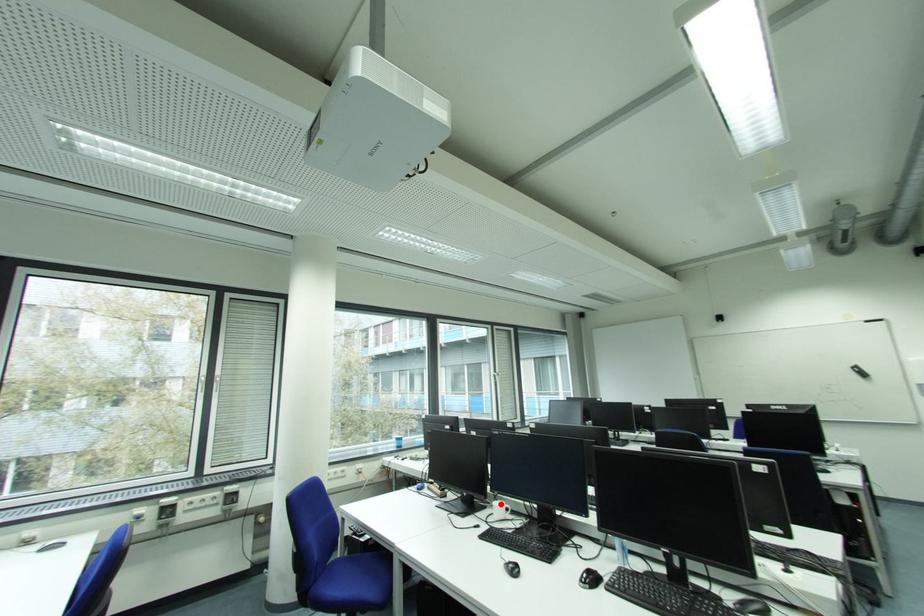
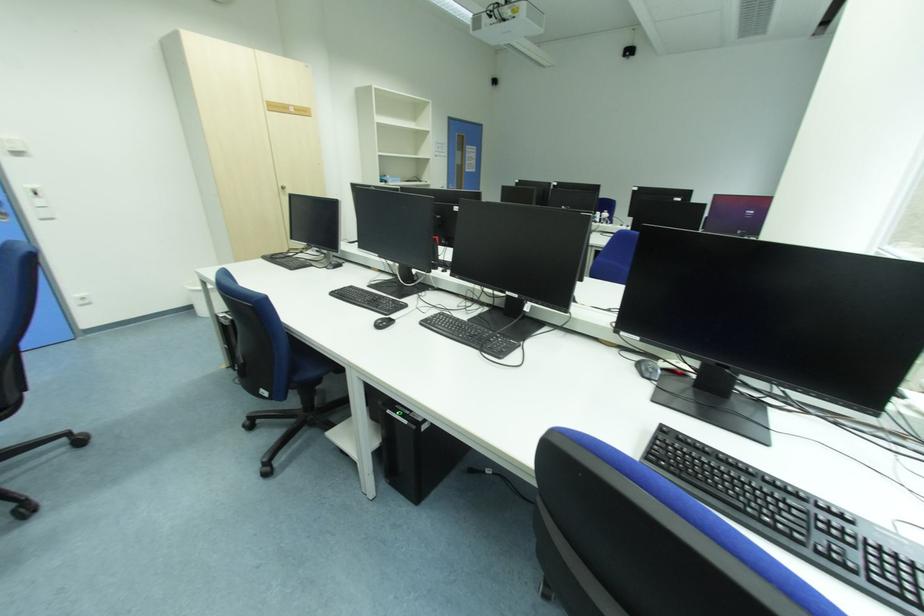
Question: I am providing you with two images of the same scene from different viewpoints. A red point is marked on the first image. Can you still see the location of the red point in image 2?

Choices:
 (A) Yes
 (B) No

Answer: (B)